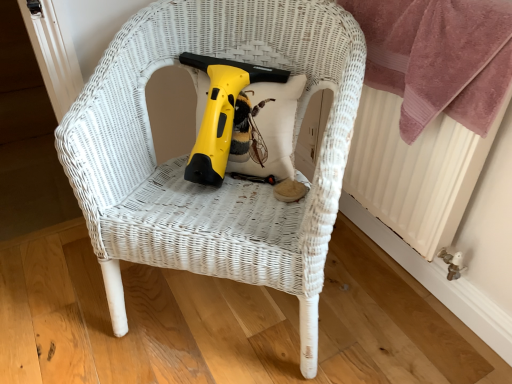
You are a GUI agent. You are given a task and a screenshot of the screen. Output one action in this format:
    pyautogui.click(x=<x>, y=<y>)
    Task: Click on the free spot below white wicker chair at center (from a real-world perspective)
    Image resolution: width=512 pixels, height=384 pixels.
    Given the screenshot: What is the action you would take?
    pyautogui.click(x=216, y=314)